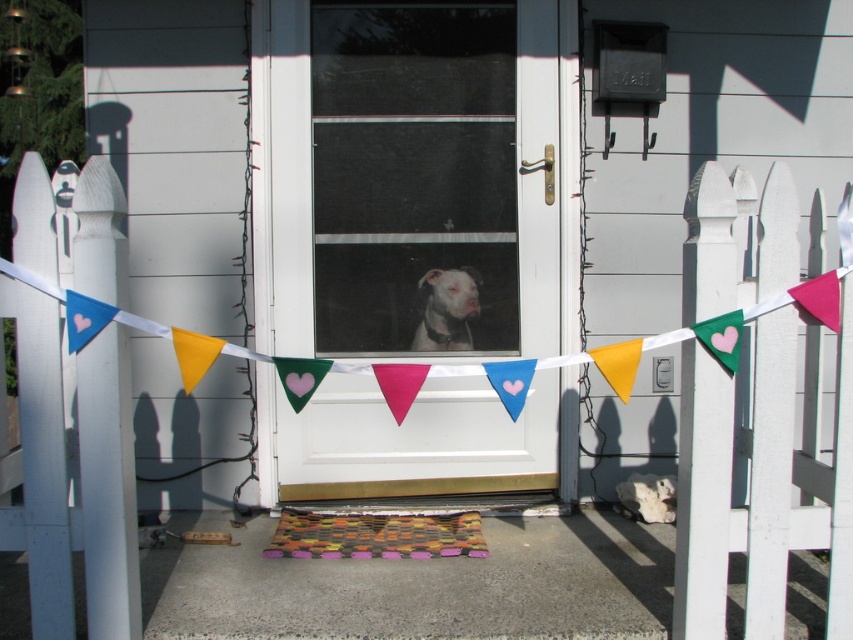
You are a delivery person trying to place a package on the porch. The package is 12 inches long. There is a multicolored woven mat at center and a white matte dog at center. Can you fit the package between them without moving either object?

The multicolored woven mat at center and white matte dog at center are 28.49 inches apart, so yes, the package which is 12 inches long can fit between them since the distance between the two objects is greater than the package length.

You are standing at the front porch and want to walk from the point at coordinates point [346,298] to the point at coordinates point [381,534]. Which direction should you move to get closer to your destination?

You should move forward because point [346,298] is behind point [381,534], so moving forward will bring you closer to your destination.